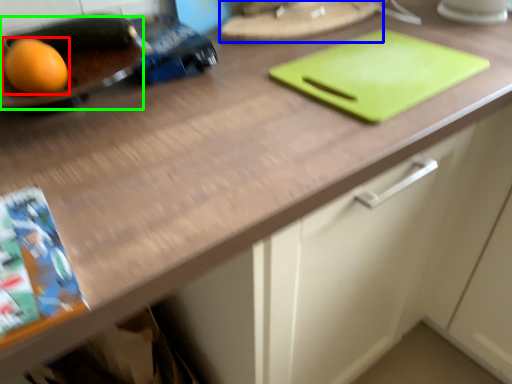
Question: Estimate the real-world distances between objects in this image. Which object is closer to grapefruit (highlighted by a red box), tray (highlighted by a blue box) or tray (highlighted by a green box)?

Choices:
 (A) tray
 (B) tray

Answer: (B)